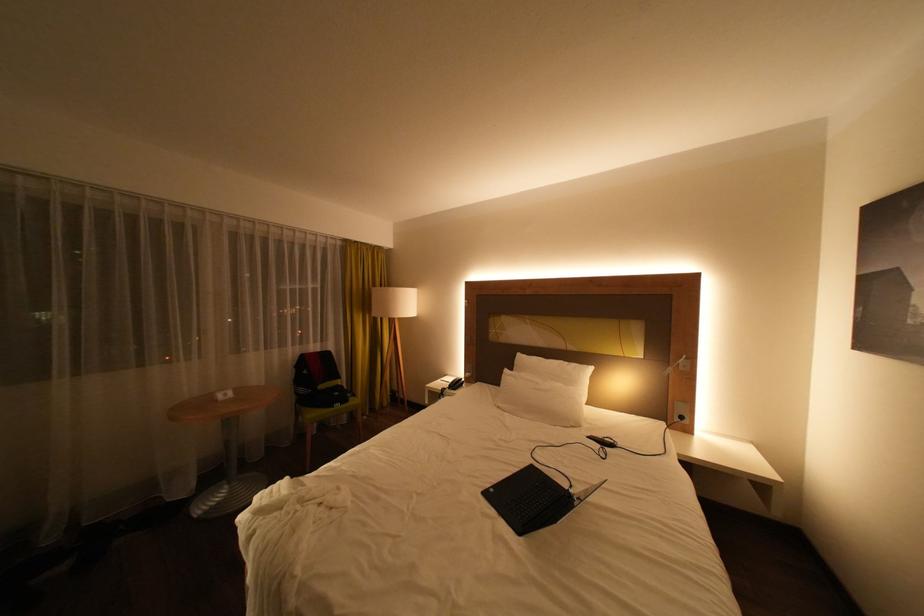
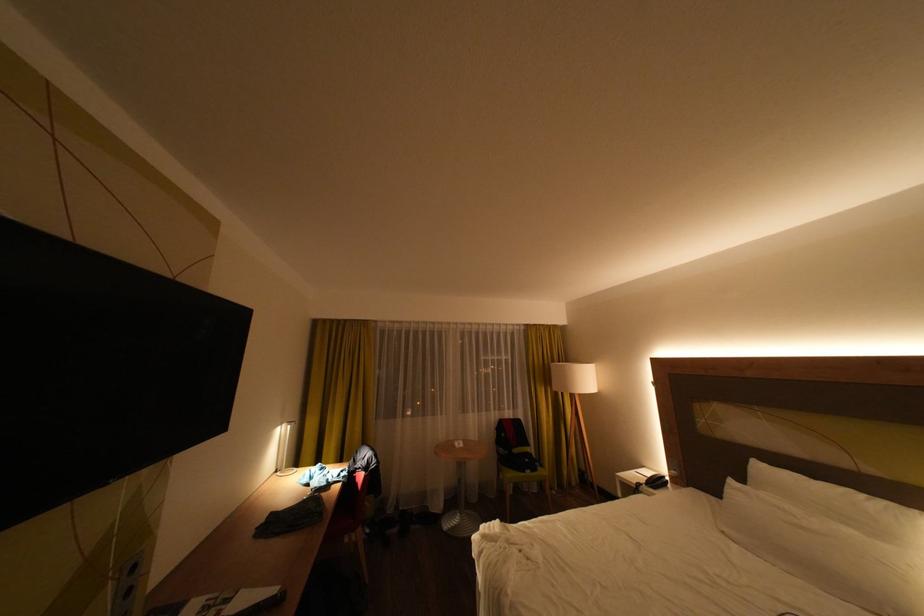
Where in the second image is the point corresponding to point 454,389 from the first image?

(649, 484)